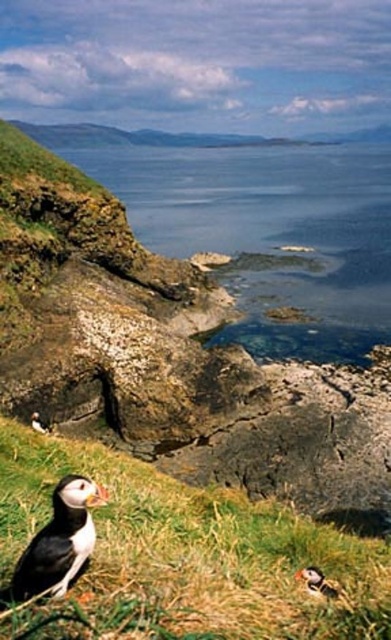
Which is more to the right, clear blue water at center or multicolored feathered puffin at lower center?

From the viewer's perspective, clear blue water at center appears more on the right side.

Between clear blue water at center and multicolored feathered puffin at lower center, which one has more height?

clear blue water at center is taller.

What do you see at coordinates (270, 232) in the screenshot? I see `clear blue water at center` at bounding box center [270, 232].

Locate an element on the screen. The height and width of the screenshot is (640, 391). clear blue water at center is located at coordinates (270, 232).

Who is shorter, black and white puffin at lower left or black feathered puffin at lower left?

Standing shorter between the two is black feathered puffin at lower left.

Which is behind, point (78, 545) or point (35, 426)?

Point (35, 426)

Locate an element on the screen. black and white puffin at lower left is located at coordinates (59, 540).

Locate an element on the screen. This screenshot has height=640, width=391. green grassy at lower left is located at coordinates (184, 556).

Is green grassy at lower left behind black feathered puffin at lower left?

No, green grassy at lower left is closer to the viewer.

Measure the distance between point (x=41, y=518) and camera.

5.03 meters

Locate an element on the screen. green grassy at lower left is located at coordinates (184, 556).